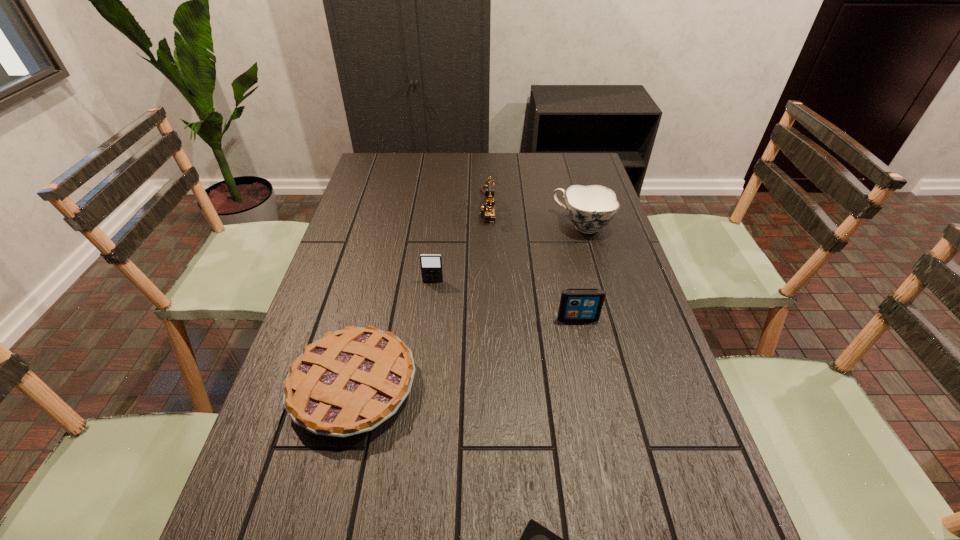
Where is `vacant area between the fourth farthest object and the farthest iPod`? vacant area between the fourth farthest object and the farthest iPod is located at coordinates (505, 300).

What are the coordinates of `the fifth closest object to the second iPod from left to right` in the screenshot? It's located at (488, 207).

Find the location of a particular element. object that is the fourth closest to the leftmost iPod is located at coordinates (590, 208).

Locate which iPod is the closest to the leftmost iPod. Please provide its 2D coordinates. Your answer should be formatted as a tuple, i.e. [(x, y)], where the tuple contains the x and y coordinates of a point satisfying the conditions above.

[(576, 304)]

The height and width of the screenshot is (540, 960). Find the location of `iPod that is the nearest to the fifth tallest object`. iPod that is the nearest to the fifth tallest object is located at coordinates (431, 264).